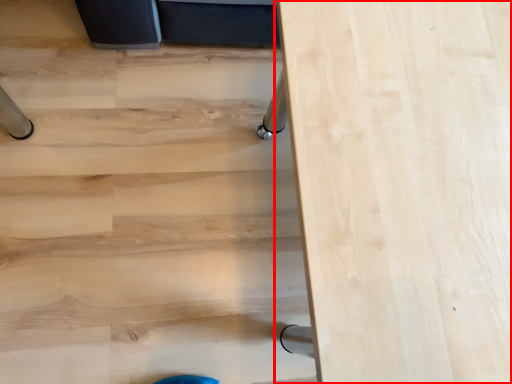
Question: In this image, where is table (annotated by the red box) located relative to stairwell?

Choices:
 (A) left
 (B) right

Answer: (B)